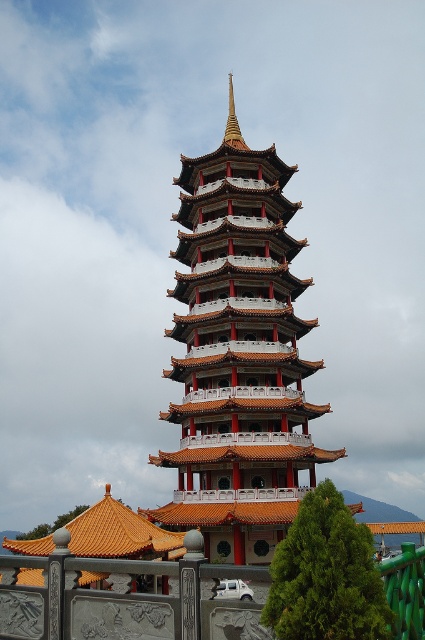
Find the location of a particular element. Image resolution: width=425 pixels, height=640 pixels. orange glazed tile tower at center is located at coordinates (238, 358).

Is orange glazed tile tower at center shorter than gold polished spire at center?

Incorrect, orange glazed tile tower at center's height does not fall short of gold polished spire at center's.

Does point (254, 524) lie in front of point (235, 145)?

That is True.

Find the location of a particular element. Image resolution: width=425 pixels, height=640 pixels. orange glazed tile tower at center is located at coordinates (238, 358).

The height and width of the screenshot is (640, 425). Describe the element at coordinates (238, 358) in the screenshot. I see `orange glazed tile tower at center` at that location.

Is point (235, 209) positioned in front of point (263, 605)?

No, it is behind (263, 605).

You are a GUI agent. You are given a task and a screenshot of the screen. Output one action in this format:
    pyautogui.click(x=<x>, y=<y>)
    Task: Click on the orange glazed tile tower at center
    The image size is (425, 640).
    Given the screenshot: What is the action you would take?
    tap(238, 358)

Is gray stone railing at lower center wider than gold polished spire at center?

Correct, the width of gray stone railing at lower center exceeds that of gold polished spire at center.

Is point (0, 634) closer to camera compared to point (232, 113)?

Yes, point (0, 634) is closer to viewer.

Where is `gray stone railing at lower center`? The height and width of the screenshot is (640, 425). gray stone railing at lower center is located at coordinates (121, 602).